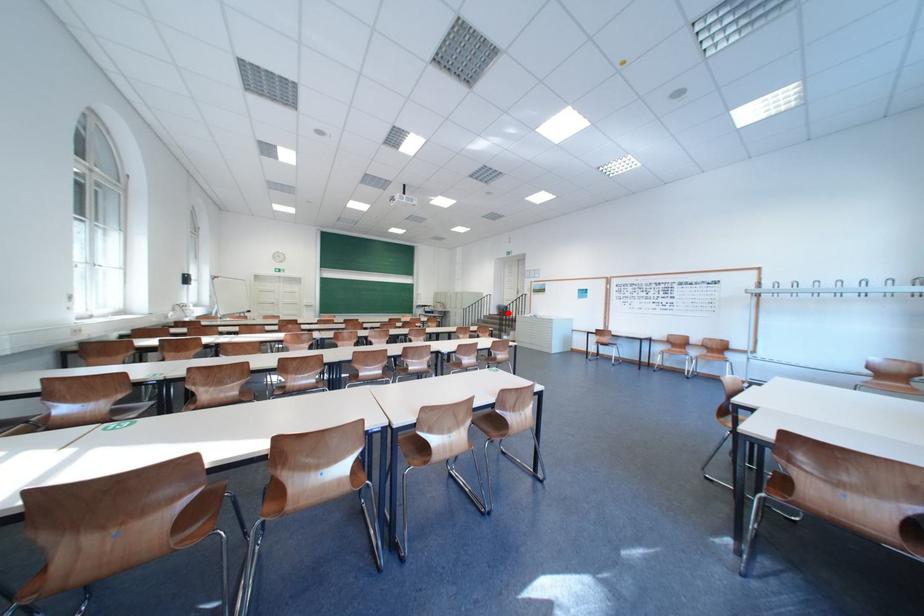
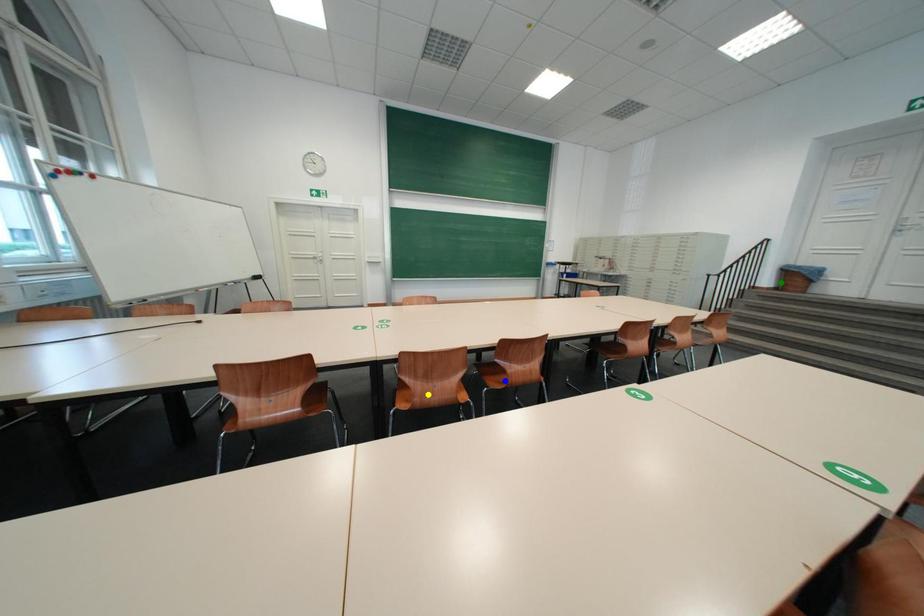
Question: I am providing you with two images of the same scene from different viewpoints. A red point is marked on the first image. You are given multiple points on the second image. Can you choose the point in image 2 that corresponds to the point in image 1?

Choices:
 (A) blue point
 (B) green point
 (C) yellow point

Answer: (B)